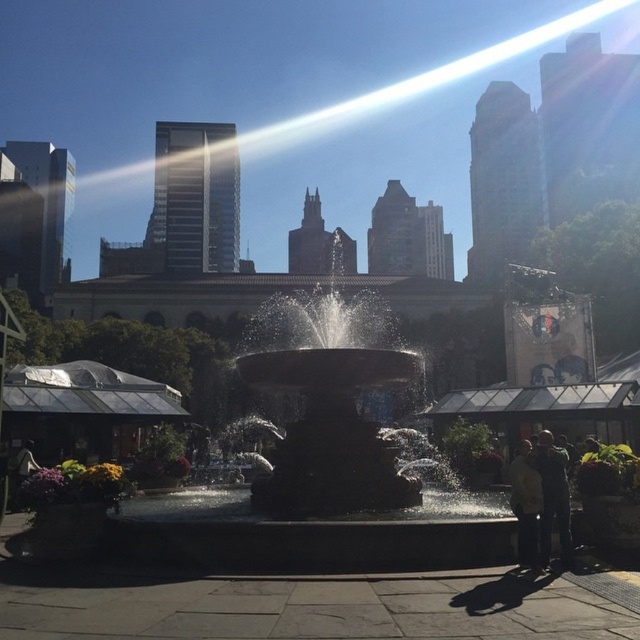
You are standing at the center of the fountain and want to retrieve your dark gray jacket at lower right. In which direction should you walk to reach it?

You should walk towards the lower right direction to reach the dark gray jacket at lower right as it is located at point (x=552, y=497).